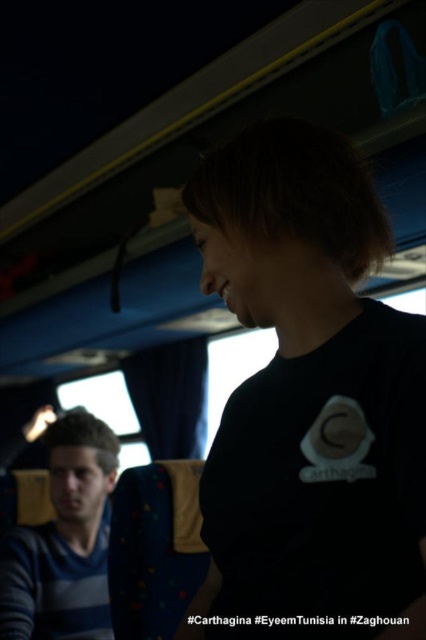
What do you see at coordinates (310, 401) in the screenshot? This screenshot has width=426, height=640. I see `black matte shirt at center` at bounding box center [310, 401].

Who is higher up, black matte shirt at center or blue striped shirt at lower left?

Positioned higher is black matte shirt at center.

Does point (206, 195) come behind point (92, 416)?

No, (206, 195) is in front of (92, 416).

Where is `black matte shirt at center`? The height and width of the screenshot is (640, 426). black matte shirt at center is located at coordinates (310, 401).